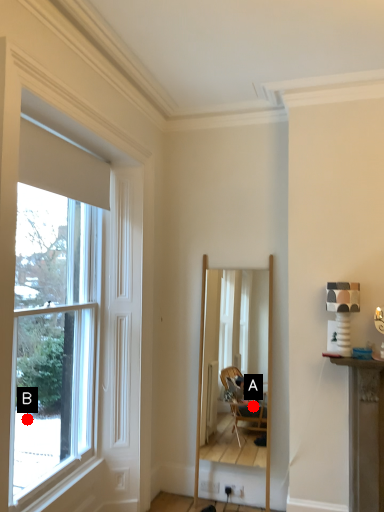
Question: Two points are circled on the image, labeled by A and B beside each circle. Which point is closer to the camera taking this photo?

Choices:
 (A) A is closer
 (B) B is closer

Answer: (B)